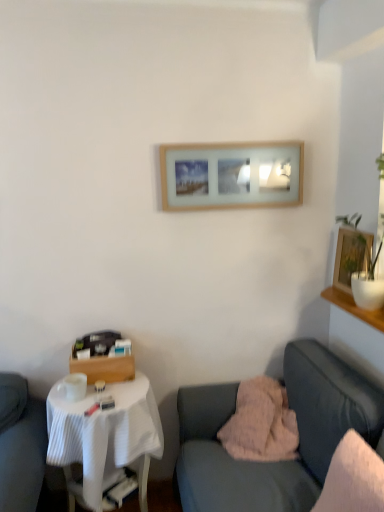
Image resolution: width=384 pixels, height=512 pixels. Identify the location of white soft pillow at right, the 2th pillow positioned from the back. point(353,478).

What do you see at coordinates (353, 478) in the screenshot?
I see `white soft pillow at right, the 2th pillow positioned from the back` at bounding box center [353, 478].

Image resolution: width=384 pixels, height=512 pixels. What do you see at coordinates (105, 435) in the screenshot? I see `white fabric-covered table at lower left` at bounding box center [105, 435].

This screenshot has height=512, width=384. Find the location of `fluffy pink pillow at lower center, the first pillow viewed from the back`. fluffy pink pillow at lower center, the first pillow viewed from the back is located at coordinates click(x=261, y=423).

Where is `wooden framed picture at upper right, marked as the first picture frame in a bottom-to-top arrangement`? The width and height of the screenshot is (384, 512). wooden framed picture at upper right, marked as the first picture frame in a bottom-to-top arrangement is located at coordinates (351, 256).

You are a GUI agent. You are given a task and a screenshot of the screen. Output one action in this format:
    pyautogui.click(x=<x>, y=<y>)
    Task: Click on the wooden picture frame at upper center, arranged as the 1th picture frame when viewed from the top
    The height and width of the screenshot is (512, 384).
    Given the screenshot: What is the action you would take?
    pyautogui.click(x=231, y=175)

The image size is (384, 512). In order to click on velvet pink blanket at lower right in this screenshot , I will do [x=299, y=435].

Where is `pillow that is the 1st object to the left of the wooden framed picture at upper right, which is the 2th picture frame in left-to-right order, starting at the anchor`? The image size is (384, 512). pillow that is the 1st object to the left of the wooden framed picture at upper right, which is the 2th picture frame in left-to-right order, starting at the anchor is located at coordinates pyautogui.click(x=353, y=478).

Is white soft pillow at right, the first pillow when ordered from front to back, thinner than wooden framed picture at upper right, the first picture frame from the right?

No.

Is white soft pillow at right, the 2th pillow positioned from the back, placed right next to wooden framed picture at upper right, marked as the first picture frame in a bottom-to-top arrangement?

No, white soft pillow at right, the 2th pillow positioned from the back, is not making contact with wooden framed picture at upper right, marked as the first picture frame in a bottom-to-top arrangement.

From the picture: From a real-world perspective, between white soft pillow at right, the 2th pillow positioned from the back, and wooden framed picture at upper right, marked as the first picture frame in a bottom-to-top arrangement, who is vertically higher?

wooden framed picture at upper right, marked as the first picture frame in a bottom-to-top arrangement.

Which is more distant, (337, 276) or (339, 361)?

The point (337, 276) is farther from the camera.

Considering the sizes of objects wooden framed picture at upper right, the 2th picture frame from the top, and velvet pink blanket at lower right in the image provided, who is thinner, wooden framed picture at upper right, the 2th picture frame from the top, or velvet pink blanket at lower right?

With smaller width is wooden framed picture at upper right, the 2th picture frame from the top.

How many degrees apart are the facing directions of wooden framed picture at upper right, marked as the first picture frame in a bottom-to-top arrangement, and velvet pink blanket at lower right?

There is a 0.102-degree angle between the facing directions of wooden framed picture at upper right, marked as the first picture frame in a bottom-to-top arrangement, and velvet pink blanket at lower right.

Is point (234, 452) more distant than point (279, 510)?

Yes, it is behind point (279, 510).

Considering the positions of objects fluffy pink pillow at lower center, the first pillow viewed from the back, and velvet pink blanket at lower right in the image provided, who is more to the right, fluffy pink pillow at lower center, the first pillow viewed from the back, or velvet pink blanket at lower right?

Positioned to the right is velvet pink blanket at lower right.

Is fluffy pink pillow at lower center, the first pillow viewed from the back, positioned with its back to velvet pink blanket at lower right?

That's right, fluffy pink pillow at lower center, the first pillow viewed from the back, is facing away from velvet pink blanket at lower right.

In the scene shown: Between fluffy pink pillow at lower center, the second pillow positioned from the front, and velvet pink blanket at lower right, which one has smaller width?

fluffy pink pillow at lower center, the second pillow positioned from the front, is thinner.

Which object is thinner, velvet pink blanket at lower right or white soft pillow at right, the first pillow when ordered from front to back?

white soft pillow at right, the first pillow when ordered from front to back, is thinner.

Is point (256, 485) positioned behind point (367, 449)?

Yes, it is.

From a real-world perspective, who is located higher, velvet pink blanket at lower right or white soft pillow at right, the first pillow when ordered from front to back?

From a 3D spatial view, white soft pillow at right, the first pillow when ordered from front to back, is above.

Considering the relative sizes of velvet pink blanket at lower right and white soft pillow at right, the 2th pillow positioned from the back, in the image provided, is velvet pink blanket at lower right shorter than white soft pillow at right, the 2th pillow positioned from the back,?

No.

The width and height of the screenshot is (384, 512). Identify the location of the 2nd picture frame behind the velvet pink blanket at lower right, counting from the anchor's position. (231, 175).

Which of these two, wooden picture frame at upper center, the first picture frame when ordered from left to right, or velvet pink blanket at lower right, is smaller?

wooden picture frame at upper center, the first picture frame when ordered from left to right.

Is wooden picture frame at upper center, the first picture frame when ordered from left to right, surrounding velvet pink blanket at lower right?

No, velvet pink blanket at lower right is not a part of wooden picture frame at upper center, the first picture frame when ordered from left to right.

Is wooden picture frame at upper center, arranged as the 1th picture frame when viewed from the top, beside velvet pink blanket at lower right?

No, wooden picture frame at upper center, arranged as the 1th picture frame when viewed from the top, is not in contact with velvet pink blanket at lower right.

You are a GUI agent. You are given a task and a screenshot of the screen. Output one action in this format:
    pyautogui.click(x=<x>, y=<y>)
    Task: Click on the picture frame below the wooden picture frame at upper center, the first picture frame when ordered from left to right (from a real-world perspective)
    The height and width of the screenshot is (512, 384).
    Given the screenshot: What is the action you would take?
    pyautogui.click(x=351, y=256)

Is there a large distance between wooden picture frame at upper center, the first picture frame when ordered from left to right, and wooden framed picture at upper right, which is the 2th picture frame in left-to-right order?

No, there isn't a large distance between wooden picture frame at upper center, the first picture frame when ordered from left to right, and wooden framed picture at upper right, which is the 2th picture frame in left-to-right order.

Can you tell me how much wooden picture frame at upper center, arranged as the 1th picture frame when viewed from the top, and wooden framed picture at upper right, the first picture frame from the right, differ in facing direction?

wooden picture frame at upper center, arranged as the 1th picture frame when viewed from the top, and wooden framed picture at upper right, the first picture frame from the right, are facing 89.1 degrees away from each other.

Considering the sizes of objects wooden picture frame at upper center, arranged as the 1th picture frame when viewed from the top, and wooden framed picture at upper right, the 2th picture frame from the top, in the image provided, who is wider, wooden picture frame at upper center, arranged as the 1th picture frame when viewed from the top, or wooden framed picture at upper right, the 2th picture frame from the top,?

wooden framed picture at upper right, the 2th picture frame from the top.

From the image's perspective, is white fabric-covered table at lower left located above or below fluffy pink pillow at lower center, the second pillow positioned from the front?

white fabric-covered table at lower left is below fluffy pink pillow at lower center, the second pillow positioned from the front.

Is white fabric-covered table at lower left oriented towards fluffy pink pillow at lower center, the first pillow viewed from the back?

No, white fabric-covered table at lower left is not oriented towards fluffy pink pillow at lower center, the first pillow viewed from the back.

How many degrees apart are the facing directions of white fabric-covered table at lower left and fluffy pink pillow at lower center, the second pillow positioned from the front?

They differ by 1.27 degrees in their facing directions.

From the picture: Visually, is white fabric-covered table at lower left positioned to the left or to the right of fluffy pink pillow at lower center, the second pillow positioned from the front?

In the image, white fabric-covered table at lower left appears on the left side of fluffy pink pillow at lower center, the second pillow positioned from the front.

Where is `the 1st pillow counting from the left side of the wooden framed picture at upper right, the first picture frame from the right`? the 1st pillow counting from the left side of the wooden framed picture at upper right, the first picture frame from the right is located at coordinates (353, 478).

You are a GUI agent. You are given a task and a screenshot of the screen. Output one action in this format:
    pyautogui.click(x=<x>, y=<y>)
    Task: Click on the picture frame that is the 1st one when counting backward from the velvet pink blanket at lower right
    
    Given the screenshot: What is the action you would take?
    pyautogui.click(x=351, y=256)

From the image, which object appears to be farther from wooden picture frame at upper center, the 2th picture frame in the right-to-left sequence, velvet pink blanket at lower right or fluffy pink pillow at lower center, the first pillow viewed from the back?

The object further to wooden picture frame at upper center, the 2th picture frame in the right-to-left sequence, is fluffy pink pillow at lower center, the first pillow viewed from the back.

Considering their positions, is wooden picture frame at upper center, the 2th picture frame in the right-to-left sequence, positioned further to velvet pink blanket at lower right than wooden framed picture at upper right, marked as the first picture frame in a bottom-to-top arrangement?

Based on the image, wooden picture frame at upper center, the 2th picture frame in the right-to-left sequence, appears to be further to velvet pink blanket at lower right.

Considering their positions, is white fabric-covered table at lower left positioned further to wooden framed picture at upper right, which is the 2th picture frame in left-to-right order, than wooden picture frame at upper center, arranged as the 1th picture frame when viewed from the top?

white fabric-covered table at lower left lies further to wooden framed picture at upper right, which is the 2th picture frame in left-to-right order, than the other object.

Estimate the real-world distances between objects in this image. Which object is closer to white soft pillow at right, the first pillow when ordered from front to back, wooden picture frame at upper center, the first picture frame when ordered from left to right, or fluffy pink pillow at lower center, the second pillow positioned from the front?

fluffy pink pillow at lower center, the second pillow positioned from the front, lies closer to white soft pillow at right, the first pillow when ordered from front to back, than the other object.

Based on their spatial positions, is white fabric-covered table at lower left or wooden picture frame at upper center, which ranks as the 2th picture frame in bottom-to-top order, closer to white soft pillow at right, the first pillow when ordered from front to back?

The object closer to white soft pillow at right, the first pillow when ordered from front to back, is white fabric-covered table at lower left.

Looking at the image, which one is located closer to velvet pink blanket at lower right, fluffy pink pillow at lower center, the second pillow positioned from the front, or wooden framed picture at upper right, the first picture frame from the right?

Based on the image, fluffy pink pillow at lower center, the second pillow positioned from the front, appears to be nearer to velvet pink blanket at lower right.

Estimate the real-world distances between objects in this image. Which object is further from white fabric-covered table at lower left, fluffy pink pillow at lower center, the second pillow positioned from the front, or wooden framed picture at upper right, the 2th picture frame from the top?

The object further to white fabric-covered table at lower left is wooden framed picture at upper right, the 2th picture frame from the top.

Based on the photo, which object lies further to the anchor point velvet pink blanket at lower right, white soft pillow at right, the 2th pillow positioned from the back, or wooden picture frame at upper center, the first picture frame when ordered from left to right?

Among the two, wooden picture frame at upper center, the first picture frame when ordered from left to right, is located further to velvet pink blanket at lower right.

Find the location of `picture frame that lies between wooden picture frame at upper center, which ranks as the 2th picture frame in bottom-to-top order, and white fabric-covered table at lower left from top to bottom`. picture frame that lies between wooden picture frame at upper center, which ranks as the 2th picture frame in bottom-to-top order, and white fabric-covered table at lower left from top to bottom is located at coordinates (351, 256).

You are a GUI agent. You are given a task and a screenshot of the screen. Output one action in this format:
    pyautogui.click(x=<x>, y=<y>)
    Task: Click on the picture frame between wooden picture frame at upper center, the 2th picture frame in the right-to-left sequence, and velvet pink blanket at lower right, in the vertical direction
    The height and width of the screenshot is (512, 384).
    Given the screenshot: What is the action you would take?
    point(351,256)

Find the location of a particular element. Image resolution: width=384 pixels, height=512 pixels. studio couch between white fabric-covered table at lower left and white soft pillow at right, the first pillow when ordered from front to back, from left to right is located at coordinates click(299, 435).

Image resolution: width=384 pixels, height=512 pixels. In order to click on pillow between wooden picture frame at upper center, the 2th picture frame in the right-to-left sequence, and white soft pillow at right, the first pillow when ordered from front to back, in the up-down direction in this screenshot , I will do `click(261, 423)`.